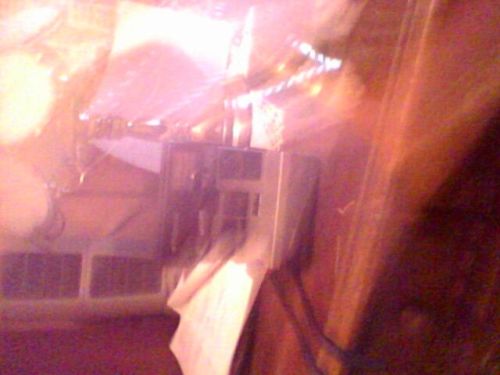
This screenshot has height=375, width=500. What are the coordinates of `floor` in the screenshot? It's located at (96, 350).